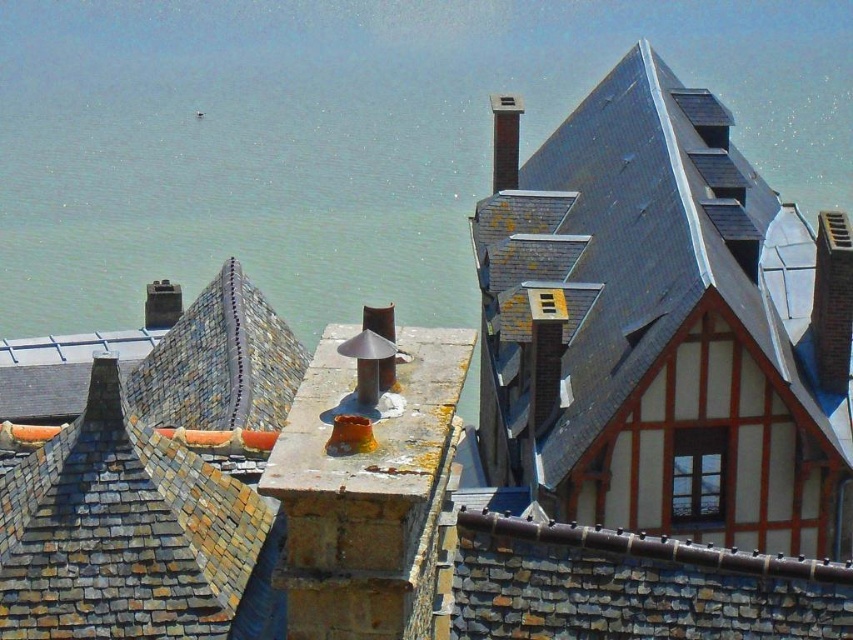
Measure the distance between shiny slate roof at upper right and camera.

shiny slate roof at upper right and camera are 40.81 meters apart from each other.

Is shiny slate roof at upper right to the right of smooth silver chimney at upper center from the viewer's perspective?

Indeed, shiny slate roof at upper right is positioned on the right side of smooth silver chimney at upper center.

Find the location of a particular element. The image size is (853, 640). shiny slate roof at upper right is located at coordinates (631, 262).